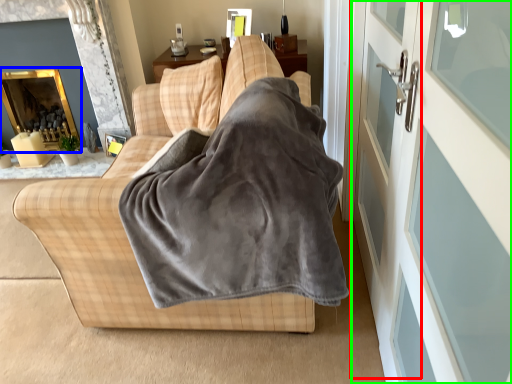
Question: Estimate the real-world distances between objects in this image. Which object is farther from screen door (highlighted by a red box), fireplace (highlighted by a blue box) or screen door (highlighted by a green box)?

Choices:
 (A) fireplace
 (B) screen door

Answer: (A)